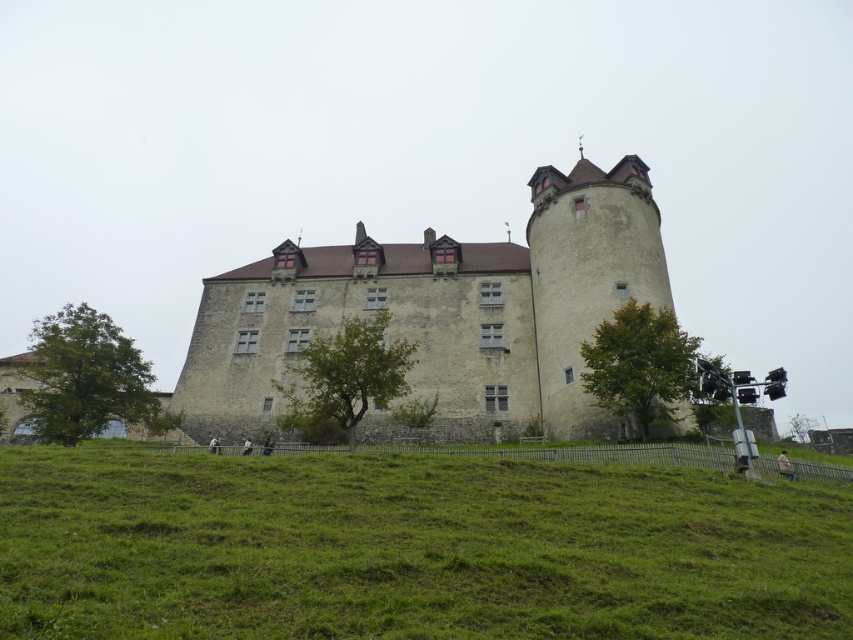
Can you confirm if green grassy hillside at lower center is smaller than stone castle at center?

Yes, green grassy hillside at lower center is smaller than stone castle at center.

Between point (611, 547) and point (358, 294), which one is positioned behind?

The point (358, 294) is behind.

Where is `green grassy hillside at lower center`? The height and width of the screenshot is (640, 853). green grassy hillside at lower center is located at coordinates (410, 548).

Can you confirm if green grassy hillside at lower center is positioned to the right of stone tower at right?

In fact, green grassy hillside at lower center is to the left of stone tower at right.

Is green grassy hillside at lower center bigger than stone tower at right?

Incorrect, green grassy hillside at lower center is not larger than stone tower at right.

Is point (241, 544) more distant than point (659, 262)?

No, it is not.

In order to click on green grassy hillside at lower center in this screenshot , I will do `click(410, 548)`.

Can you confirm if stone castle at center is positioned below stone tower at right?

Indeed, stone castle at center is positioned under stone tower at right.

Who is positioned more to the right, stone castle at center or stone tower at right?

From the viewer's perspective, stone tower at right appears more on the right side.

Locate an element on the screen. stone castle at center is located at coordinates (444, 312).

Image resolution: width=853 pixels, height=640 pixels. I want to click on stone castle at center, so click(444, 312).